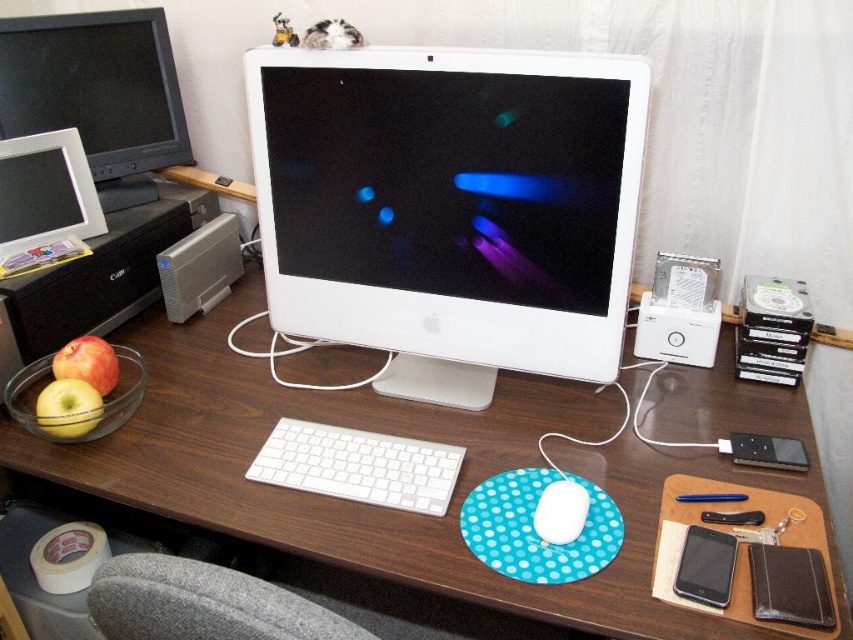
Is point (258, 481) positioned after point (720, 538)?

Yes, point (258, 481) is farther from viewer.

Who is positioned more to the right, white matte keyboard at center or matte black smartphone at lower right?

matte black smartphone at lower right

Is point (323, 481) positioned in front of point (722, 605)?

No, (323, 481) is further to viewer.

Locate an element on the screen. This screenshot has height=640, width=853. white matte keyboard at center is located at coordinates (358, 465).

Does white glossy computer monitor at center have a lesser height compared to white matte mouse at center?

In fact, white glossy computer monitor at center may be taller than white matte mouse at center.

Is point (619, 240) less distant than point (567, 536)?

No, (619, 240) is behind (567, 536).

Who is more distant from viewer, (608, 161) or (570, 500)?

Point (608, 161)

Find the location of a particular element. The image size is (853, 640). white glossy computer monitor at center is located at coordinates (450, 209).

Is white glossy computer monitor at center shorter than gray fabric chair at lower left?

Incorrect, white glossy computer monitor at center's height does not fall short of gray fabric chair at lower left's.

Is the position of white glossy computer monitor at center more distant than that of gray fabric chair at lower left?

Yes, it is.

You are a GUI agent. You are given a task and a screenshot of the screen. Output one action in this format:
    pyautogui.click(x=<x>, y=<y>)
    Task: Click on the white glossy computer monitor at center
    
    Given the screenshot: What is the action you would take?
    pyautogui.click(x=450, y=209)